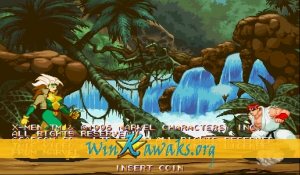
The height and width of the screenshot is (175, 300). What are the coordinates of `tropical plant` in the screenshot? It's located at (271, 98).